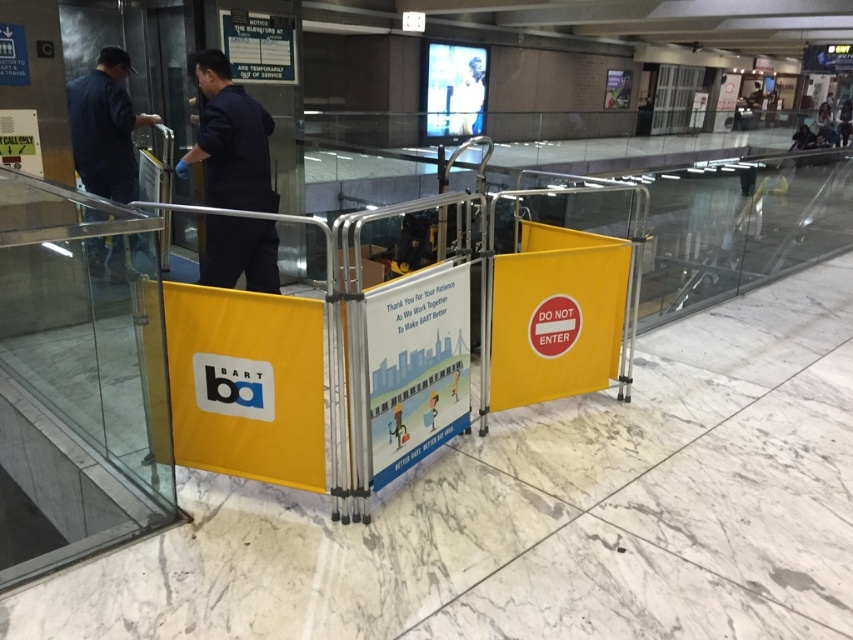
You are a visitor at the BART station and need to locate the staff member wearing the dark blue uniform at center. According to the coordinates provided, where should you look to find them?

The dark blue uniform at center is located at coordinates point (229,140).